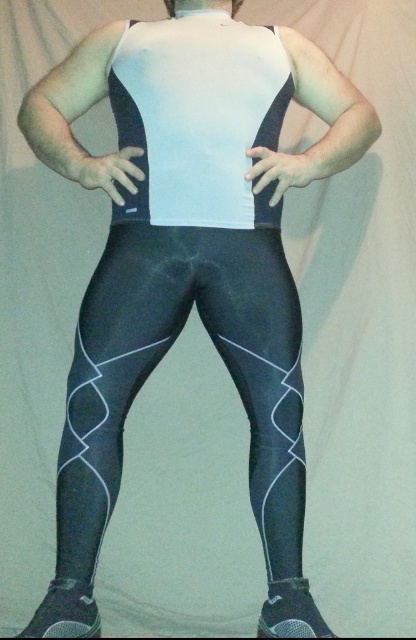
Question: Does black spandex leggings at center appear under white matte vest at center?

Choices:
 (A) no
 (B) yes

Answer: (B)

Question: Does black spandex leggings at center have a larger size compared to white matte vest at center?

Choices:
 (A) yes
 (B) no

Answer: (A)

Question: Does black spandex leggings at center have a larger size compared to white matte vest at center?

Choices:
 (A) no
 (B) yes

Answer: (B)

Question: Which point is farther to the camera?

Choices:
 (A) white matte vest at center
 (B) black spandex leggings at center

Answer: (A)